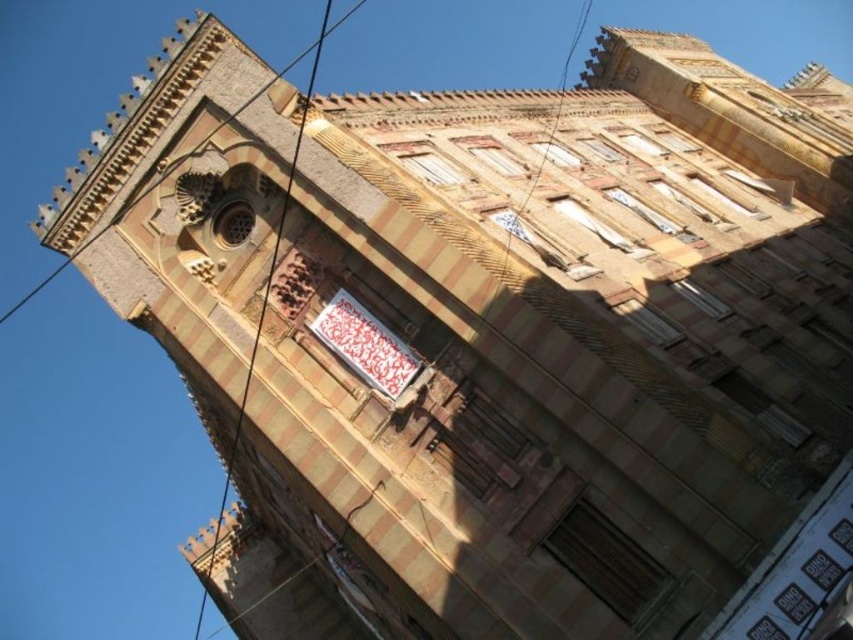
Describe the element at coordinates (364, 344) in the screenshot. I see `white fabric sign at center` at that location.

You are a GUI agent. You are given a task and a screenshot of the screen. Output one action in this format:
    pyautogui.click(x=<x>, y=<y>)
    Task: Click on the white fabric sign at center
    
    Given the screenshot: What is the action you would take?
    pyautogui.click(x=364, y=344)